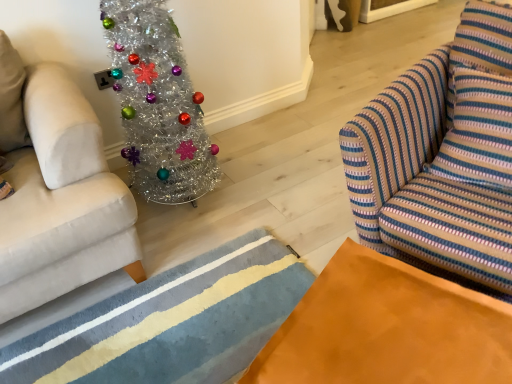
Question: Is shiny silver christmas tree at left thinner than orange suede table at lower right?

Choices:
 (A) yes
 (B) no

Answer: (A)

Question: Does shiny silver christmas tree at left have a smaller size compared to orange suede table at lower right?

Choices:
 (A) no
 (B) yes

Answer: (A)

Question: Does shiny silver christmas tree at left contain orange suede table at lower right?

Choices:
 (A) no
 (B) yes

Answer: (A)

Question: Are shiny silver christmas tree at left and orange suede table at lower right beside each other?

Choices:
 (A) yes
 (B) no

Answer: (B)

Question: Does shiny silver christmas tree at left appear on the right side of orange suede table at lower right?

Choices:
 (A) no
 (B) yes

Answer: (A)

Question: Is shiny silver christmas tree at left bigger or smaller than striped fabric swivel chair at right?

Choices:
 (A) big
 (B) small

Answer: (B)

Question: Considering the positions of shiny silver christmas tree at left and striped fabric swivel chair at right in the image, is shiny silver christmas tree at left wider or thinner than striped fabric swivel chair at right?

Choices:
 (A) thin
 (B) wide

Answer: (A)

Question: Is point (130, 139) positioned closer to the camera than point (503, 34)?

Choices:
 (A) farther
 (B) closer

Answer: (A)

Question: Is shiny silver christmas tree at left in front of or behind striped fabric swivel chair at right in the image?

Choices:
 (A) behind
 (B) front

Answer: (A)

Question: In the image, is striped fabric swivel chair at right positioned in front of or behind orange suede table at lower right?

Choices:
 (A) behind
 (B) front

Answer: (A)

Question: Based on their positions, is striped fabric swivel chair at right located to the left or right of orange suede table at lower right?

Choices:
 (A) left
 (B) right

Answer: (B)

Question: From the image's perspective, is striped fabric swivel chair at right above or below orange suede table at lower right?

Choices:
 (A) below
 (B) above

Answer: (B)

Question: Considering the positions of striped fabric swivel chair at right and orange suede table at lower right in the image, is striped fabric swivel chair at right taller or shorter than orange suede table at lower right?

Choices:
 (A) tall
 (B) short

Answer: (A)

Question: Does point (160, 188) appear closer or farther from the camera than point (143, 301)?

Choices:
 (A) farther
 (B) closer

Answer: (A)

Question: From the image's perspective, is shiny silver christmas tree at left above or below textured wool rug at lower center?

Choices:
 (A) above
 (B) below

Answer: (A)